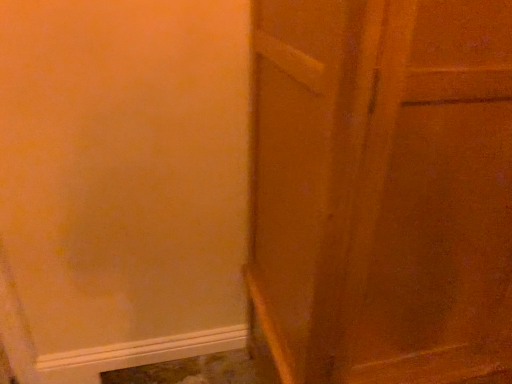
The width and height of the screenshot is (512, 384). Describe the element at coordinates (382, 190) in the screenshot. I see `wooden door at right` at that location.

Identify the location of wooden door at right. The width and height of the screenshot is (512, 384). (382, 190).

Image resolution: width=512 pixels, height=384 pixels. Find the location of `wooden door at right`. wooden door at right is located at coordinates (382, 190).